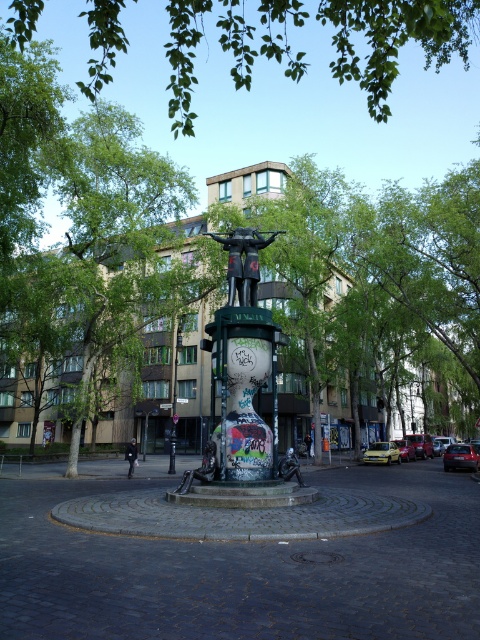
You are a city planner evaluating the space around the black matte sculpture at center and the yellow matte car at center. Which object has a narrower width when viewed from above?

The black matte sculpture at center is thinner than the yellow matte car at center, so the black matte sculpture at center has a narrower width when viewed from above.